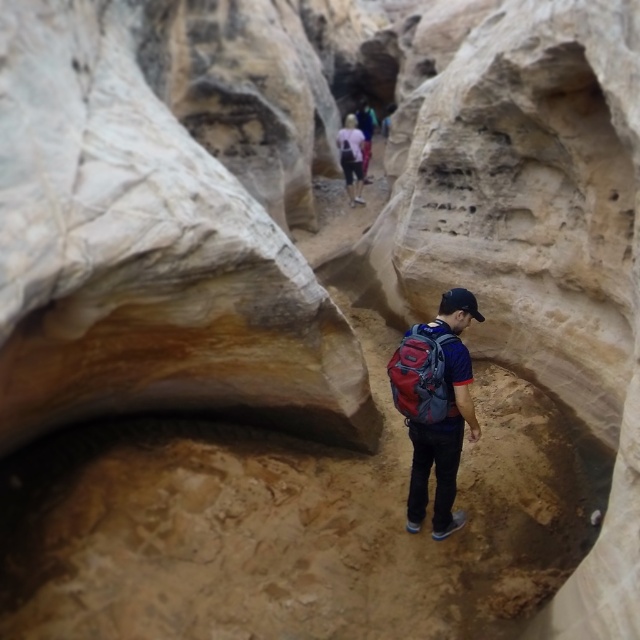
Looking at this image, between matte blue backpack at center and red fabric backpack at center, which one is positioned lower?

matte blue backpack at center

Consider the image. Can you confirm if matte blue backpack at center is positioned above red fabric backpack at center?

No, matte blue backpack at center is not above red fabric backpack at center.

Locate an element on the screen. The width and height of the screenshot is (640, 640). matte blue backpack at center is located at coordinates (435, 404).

Between matte blue backpack at center and pink fabric shirt at upper center, which one has more height?

Standing taller between the two is pink fabric shirt at upper center.

Can you confirm if matte blue backpack at center is wider than pink fabric shirt at upper center?

No, matte blue backpack at center is not wider than pink fabric shirt at upper center.

Is point (456, 372) farther from viewer compared to point (348, 131)?

No, (456, 372) is closer to viewer.

Locate an element on the screen. matte blue backpack at center is located at coordinates (435, 404).

Based on the photo, can you confirm if red fabric backpack at center is bigger than pink fabric shirt at upper center?

Incorrect, red fabric backpack at center is not larger than pink fabric shirt at upper center.

What do you see at coordinates (419, 378) in the screenshot?
I see `red fabric backpack at center` at bounding box center [419, 378].

The image size is (640, 640). I want to click on red fabric backpack at center, so click(419, 378).